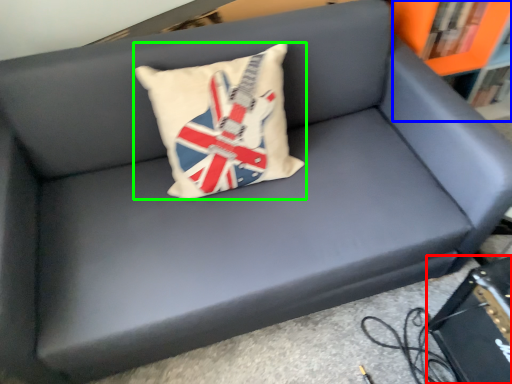
Question: Considering the real-world distances, which object is closest to paperback book (highlighted by a red box)? bookcase (highlighted by a blue box) or pillow (highlighted by a green box).

Choices:
 (A) bookcase
 (B) pillow

Answer: (B)